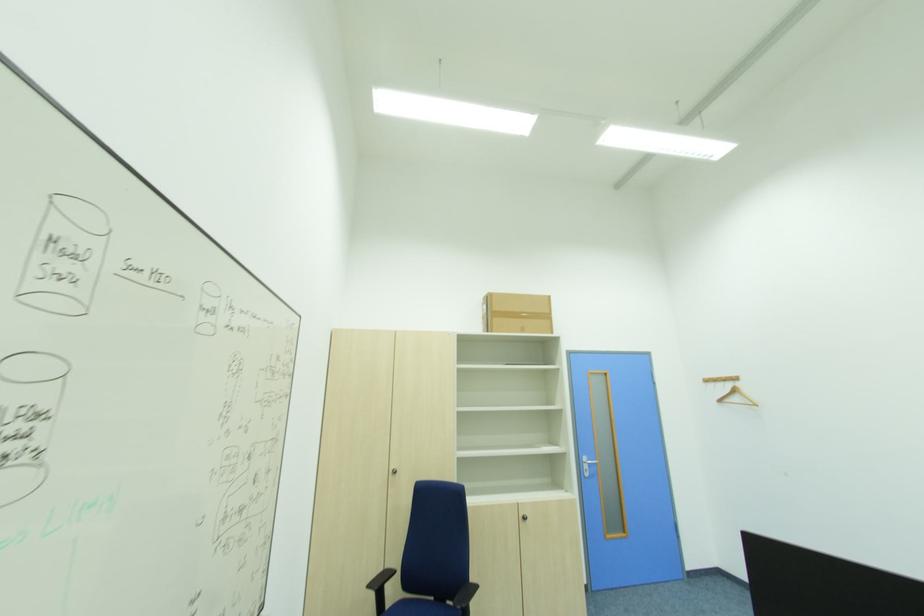
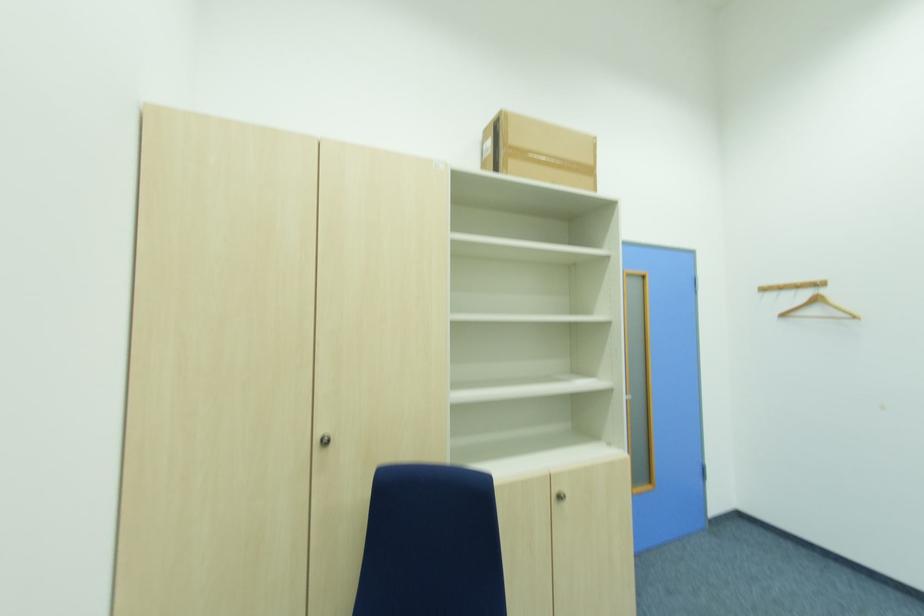
Question: What movement of the cameraman would produce the second image?

Choices:
 (A) Left
 (B) Right
 (C) Forward
 (D) Backward

Answer: (C)